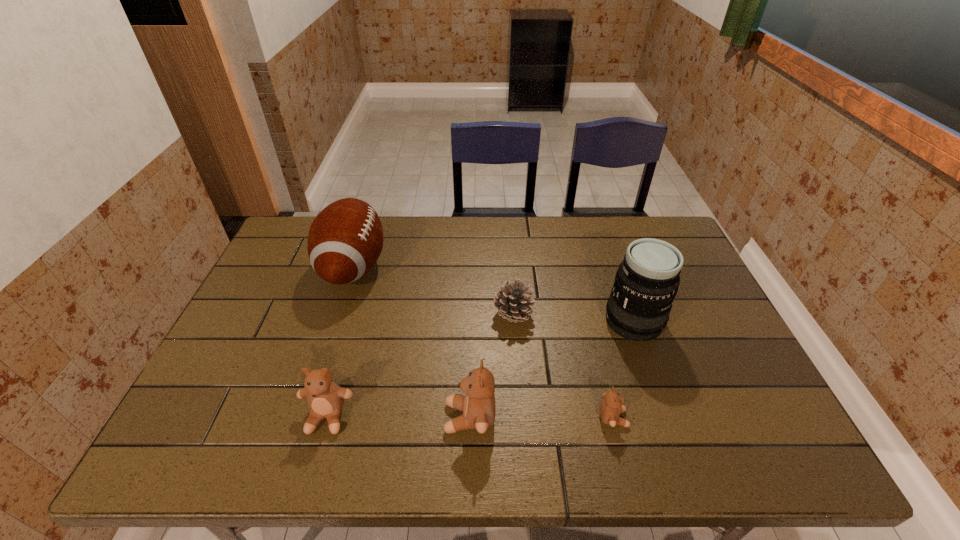
Given the evenly spaced teddy bears in the image, where should an extra teddy bear be added on the right to preserve the spacing? Please point to a vacant space. Please provide its 2D coordinates. Your answer should be formatted as a tuple, i.e. [(x, y)], where the tuple contains the x and y coordinates of a point satisfying the conditions above.

[(756, 419)]